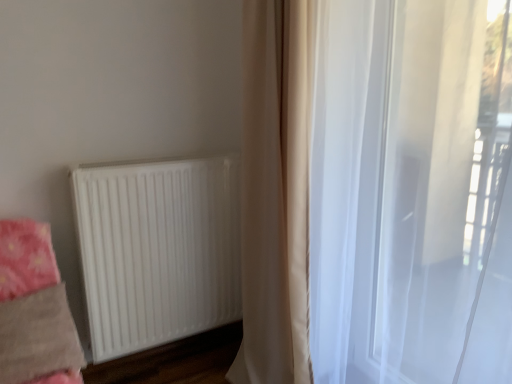
What are the coordinates of `beige fabric curtain at center, placed as the 1th curtain when sorted from left to right` in the screenshot? It's located at (275, 195).

What is the approximate width of white matte radiator at lower left?

white matte radiator at lower left is 26.38 centimeters in width.

How much space does translucent white curtain at right, which is counted as the first curtain, starting from the right, occupy vertically?

translucent white curtain at right, which is counted as the first curtain, starting from the right, is 1.66 meters in height.

This screenshot has width=512, height=384. What do you see at coordinates (26, 258) in the screenshot?
I see `fluffy pink blanket at lower left` at bounding box center [26, 258].

At what (x,y) coordinates should I click in order to perform the action: click on beige fabric curtain at center, placed as the 1th curtain when sorted from left to right. Please return your answer as a coordinate pair (x, y). This screenshot has height=384, width=512. Looking at the image, I should click on (275, 195).

Find the location of a particular element. The width and height of the screenshot is (512, 384). the 1st curtain located above the white matte radiator at lower left (from a real-world perspective) is located at coordinates (376, 192).

Which of these two, translucent white curtain at right, acting as the 2th curtain starting from the left, or white matte radiator at lower left, stands taller?

translucent white curtain at right, acting as the 2th curtain starting from the left, is taller.

From a real-world perspective, which is physically below, white matte radiator at lower left or beige fabric curtain at center, placed as the 1th curtain when sorted from left to right?

In real-world perspective, white matte radiator at lower left is lower.

From their relative heights in the image, would you say white matte radiator at lower left is taller or shorter than beige fabric curtain at center, placed as the 1th curtain when sorted from left to right?

Clearly, white matte radiator at lower left is shorter compared to beige fabric curtain at center, placed as the 1th curtain when sorted from left to right.

Considering the sizes of objects white matte radiator at lower left and beige fabric curtain at center, which appears as the second curtain when viewed from the right, in the image provided, who is thinner, white matte radiator at lower left or beige fabric curtain at center, which appears as the second curtain when viewed from the right,?

white matte radiator at lower left.

In the scene shown: Is translucent white curtain at right, which is counted as the first curtain, starting from the right, in front of fluffy pink blanket at lower left?

Yes.

Between translucent white curtain at right, acting as the 2th curtain starting from the left, and fluffy pink blanket at lower left, which one appears on the left side from the viewer's perspective?

fluffy pink blanket at lower left is more to the left.

Is fluffy pink blanket at lower left at the back of translucent white curtain at right, acting as the 2th curtain starting from the left?

No.

Is there a large distance between translucent white curtain at right, acting as the 2th curtain starting from the left, and fluffy pink blanket at lower left?

Yes, translucent white curtain at right, acting as the 2th curtain starting from the left, and fluffy pink blanket at lower left are quite far apart.

From a real-world perspective, is beige fabric curtain at center, which appears as the second curtain when viewed from the right, located higher than white matte radiator at lower left?

Yes, from a real-world perspective, beige fabric curtain at center, which appears as the second curtain when viewed from the right, is over white matte radiator at lower left

Would you consider beige fabric curtain at center, placed as the 1th curtain when sorted from left to right, to be distant from white matte radiator at lower left?

No, beige fabric curtain at center, placed as the 1th curtain when sorted from left to right, is not far from white matte radiator at lower left.

Could you measure the distance between beige fabric curtain at center, which appears as the second curtain when viewed from the right, and white matte radiator at lower left?

They are 18.50 inches apart.

Considering the positions of points (289, 3) and (238, 165), is point (289, 3) closer to camera compared to point (238, 165)?

Yes, it is.

From the image's perspective, is fluffy pink blanket at lower left below white matte radiator at lower left?

Indeed, from the image's perspective, fluffy pink blanket at lower left is shown beneath white matte radiator at lower left.

Does fluffy pink blanket at lower left turn towards white matte radiator at lower left?

No, fluffy pink blanket at lower left does not turn towards white matte radiator at lower left.

From a real-world perspective, relative to white matte radiator at lower left, is fluffy pink blanket at lower left vertically above or below?

fluffy pink blanket at lower left is situated lower than white matte radiator at lower left in the real world.

From the image's perspective, which one is positioned higher, white matte radiator at lower left or fluffy pink blanket at lower left?

white matte radiator at lower left, from the image's perspective.

At what (x,y) coordinates should I click in order to perform the action: click on bedding that is in front of the white matte radiator at lower left. Please return your answer as a coordinate pair (x, y). The height and width of the screenshot is (384, 512). Looking at the image, I should click on (26, 258).

Can you see white matte radiator at lower left touching fluffy pink blanket at lower left?

white matte radiator at lower left and fluffy pink blanket at lower left are not in contact.

What's the angular difference between white matte radiator at lower left and fluffy pink blanket at lower left's facing directions?

The angular difference between white matte radiator at lower left and fluffy pink blanket at lower left is 4.84 degrees.

Is translucent white curtain at right, acting as the 2th curtain starting from the left, in front of or behind beige fabric curtain at center, placed as the 1th curtain when sorted from left to right, in the image?

In the image, translucent white curtain at right, acting as the 2th curtain starting from the left, appears in front of beige fabric curtain at center, placed as the 1th curtain when sorted from left to right.

Considering the points (285, 254) and (278, 336), which point is behind, point (285, 254) or point (278, 336)?

The point (278, 336) is behind.

Is translucent white curtain at right, acting as the 2th curtain starting from the left, inside or outside of beige fabric curtain at center, which appears as the second curtain when viewed from the right?

translucent white curtain at right, acting as the 2th curtain starting from the left, cannot be found inside beige fabric curtain at center, which appears as the second curtain when viewed from the right.

Is the surface of translucent white curtain at right, which is counted as the first curtain, starting from the right, in direct contact with beige fabric curtain at center, placed as the 1th curtain when sorted from left to right?

There is a gap between translucent white curtain at right, which is counted as the first curtain, starting from the right, and beige fabric curtain at center, placed as the 1th curtain when sorted from left to right.

Where is `radiator that appears below the translucent white curtain at right, acting as the 2th curtain starting from the left (from the image's perspective)`? The height and width of the screenshot is (384, 512). radiator that appears below the translucent white curtain at right, acting as the 2th curtain starting from the left (from the image's perspective) is located at coordinates (158, 250).

Identify the location of the 1st curtain counting from the right side of the white matte radiator at lower left. The height and width of the screenshot is (384, 512). (275, 195).

When comparing their distances from beige fabric curtain at center, placed as the 1th curtain when sorted from left to right, does fluffy pink blanket at lower left or translucent white curtain at right, which is counted as the first curtain, starting from the right, seem further?

Based on the image, fluffy pink blanket at lower left appears to be further to beige fabric curtain at center, placed as the 1th curtain when sorted from left to right.

Considering their positions, is white matte radiator at lower left positioned further to translucent white curtain at right, which is counted as the first curtain, starting from the right, than fluffy pink blanket at lower left?

Based on the image, fluffy pink blanket at lower left appears to be further to translucent white curtain at right, which is counted as the first curtain, starting from the right.

Considering their positions, is fluffy pink blanket at lower left positioned closer to beige fabric curtain at center, which appears as the second curtain when viewed from the right, than white matte radiator at lower left?

Among the two, white matte radiator at lower left is located nearer to beige fabric curtain at center, which appears as the second curtain when viewed from the right.

Which object lies further to the anchor point translucent white curtain at right, acting as the 2th curtain starting from the left, fluffy pink blanket at lower left or white matte radiator at lower left?

Among the two, fluffy pink blanket at lower left is located further to translucent white curtain at right, acting as the 2th curtain starting from the left.

Consider the image. When comparing their distances from white matte radiator at lower left, does fluffy pink blanket at lower left or translucent white curtain at right, acting as the 2th curtain starting from the left, seem further?

translucent white curtain at right, acting as the 2th curtain starting from the left.

Based on their spatial positions, is fluffy pink blanket at lower left or beige fabric curtain at center, which appears as the second curtain when viewed from the right, closer to translucent white curtain at right, which is counted as the first curtain, starting from the right?

The object closer to translucent white curtain at right, which is counted as the first curtain, starting from the right, is beige fabric curtain at center, which appears as the second curtain when viewed from the right.

Looking at the image, which one is located closer to translucent white curtain at right, which is counted as the first curtain, starting from the right, beige fabric curtain at center, placed as the 1th curtain when sorted from left to right, or fluffy pink blanket at lower left?

beige fabric curtain at center, placed as the 1th curtain when sorted from left to right, is positioned closer to the anchor translucent white curtain at right, which is counted as the first curtain, starting from the right.

From the image, which object appears to be farther from fluffy pink blanket at lower left, beige fabric curtain at center, which appears as the second curtain when viewed from the right, or translucent white curtain at right, acting as the 2th curtain starting from the left?

The object further to fluffy pink blanket at lower left is translucent white curtain at right, acting as the 2th curtain starting from the left.

Where is `curtain located between translucent white curtain at right, acting as the 2th curtain starting from the left, and white matte radiator at lower left in the depth direction`? curtain located between translucent white curtain at right, acting as the 2th curtain starting from the left, and white matte radiator at lower left in the depth direction is located at coordinates click(x=275, y=195).

What are the coordinates of `curtain between fluffy pink blanket at lower left and translucent white curtain at right, which is counted as the first curtain, starting from the right, in the horizontal direction` in the screenshot? It's located at (275, 195).

This screenshot has width=512, height=384. Find the location of `radiator between fluffy pink blanket at lower left and beige fabric curtain at center, placed as the 1th curtain when sorted from left to right`. radiator between fluffy pink blanket at lower left and beige fabric curtain at center, placed as the 1th curtain when sorted from left to right is located at coordinates (158, 250).

At what (x,y) coordinates should I click in order to perform the action: click on radiator situated between fluffy pink blanket at lower left and translucent white curtain at right, which is counted as the first curtain, starting from the right, from left to right. Please return your answer as a coordinate pair (x, y). This screenshot has height=384, width=512. Looking at the image, I should click on (158, 250).